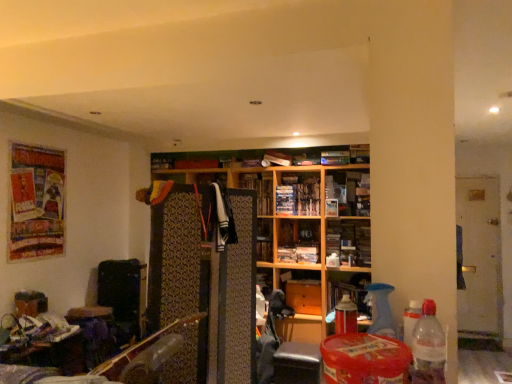
Question: From a real-world perspective, is white glossy door at right located higher than matte wood cabinet at center, arranged as the second cabinet when viewed from the left?

Choices:
 (A) no
 (B) yes

Answer: (B)

Question: Is white glossy door at right shorter than matte wood cabinet at center, arranged as the second cabinet when viewed from the left?

Choices:
 (A) no
 (B) yes

Answer: (A)

Question: Is white glossy door at right positioned behind matte wood cabinet at center, the 1th cabinet when ordered from right to left?

Choices:
 (A) no
 (B) yes

Answer: (B)

Question: Does white glossy door at right have a smaller size compared to matte wood cabinet at center, arranged as the second cabinet when viewed from the left?

Choices:
 (A) no
 (B) yes

Answer: (A)

Question: Is white glossy door at right looking in the opposite direction of matte wood cabinet at center, the 1th cabinet when ordered from right to left?

Choices:
 (A) no
 (B) yes

Answer: (A)

Question: From a real-world perspective, is matte plastic books at center, acting as the 2th book starting from the bottom, above or below clear plastic bottle at lower right?

Choices:
 (A) above
 (B) below

Answer: (A)

Question: Visually, is matte plastic books at center, acting as the 2th book starting from the bottom, positioned to the left or to the right of clear plastic bottle at lower right?

Choices:
 (A) right
 (B) left

Answer: (A)

Question: Would you say matte plastic books at center, acting as the 2th book starting from the bottom, is inside or outside clear plastic bottle at lower right?

Choices:
 (A) inside
 (B) outside

Answer: (B)

Question: Considering the positions of point (300, 200) and point (441, 357), is point (300, 200) closer or farther from the camera than point (441, 357)?

Choices:
 (A) closer
 (B) farther

Answer: (B)

Question: Considering their positions, is matte plastic books at center, the second book positioned from the top, located in front of or behind wooden bookshelf at center, which is counted as the third book, starting from the top?

Choices:
 (A) behind
 (B) front

Answer: (A)

Question: Is point (293, 190) positioned closer to the camera than point (315, 258)?

Choices:
 (A) farther
 (B) closer

Answer: (A)

Question: In terms of height, does matte plastic books at center, the second book positioned from the top, look taller or shorter compared to wooden bookshelf at center, which is counted as the third book, starting from the top?

Choices:
 (A) short
 (B) tall

Answer: (A)

Question: Considering the positions of matte plastic books at center, the second book positioned from the top, and wooden bookshelf at center, which is the first book from bottom to top, in the image, is matte plastic books at center, the second book positioned from the top, bigger or smaller than wooden bookshelf at center, which is the first book from bottom to top,?

Choices:
 (A) big
 (B) small

Answer: (B)

Question: Is wooden bookshelf at center, which is the first book from bottom to top, situated inside matte wood cabinet at center, the 1th cabinet when ordered from right to left, or outside?

Choices:
 (A) outside
 (B) inside

Answer: (A)

Question: In the image, is wooden bookshelf at center, which is the first book from bottom to top, positioned in front of or behind matte wood cabinet at center, the 1th cabinet when ordered from right to left?

Choices:
 (A) front
 (B) behind

Answer: (B)